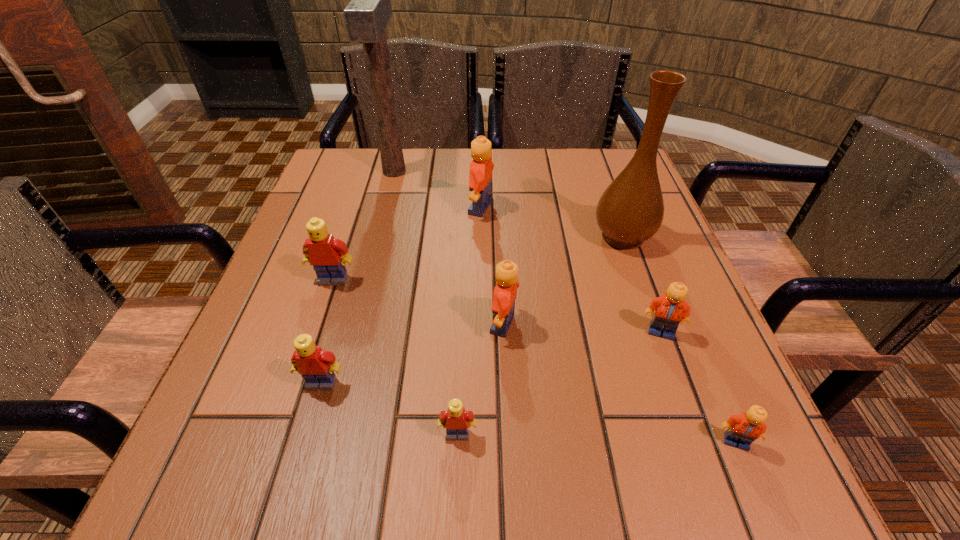
I want to click on free spot between the nearest yellow Lego and the fifth farthest Lego, so click(390, 409).

Image resolution: width=960 pixels, height=540 pixels. Identify the location of vacant space in between the third smallest orange Lego and the brown vase. (564, 280).

Image resolution: width=960 pixels, height=540 pixels. In order to click on free space between the vase and the second smallest orange Lego in this screenshot , I will do `click(641, 284)`.

Identify the location of free spot between the second smallest orange Lego and the nearest yellow Lego. (559, 383).

Identify the location of free spot between the brown vase and the farthest orange Lego. (552, 222).

I want to click on vacant space that's between the third nearest object and the smallest yellow Lego, so click(x=390, y=409).

The image size is (960, 540). What are the coordinates of `free point between the third smallest orange Lego and the biggest yellow Lego` in the screenshot? It's located at (419, 302).

This screenshot has height=540, width=960. What are the coordinates of `free point between the vase and the second smallest orange Lego` in the screenshot? It's located at (641, 284).

You are a GUI agent. You are given a task and a screenshot of the screen. Output one action in this format:
    pyautogui.click(x=<x>, y=<y>)
    Task: Click on the unoccupied position between the second biggest orange Lego and the smallest orange Lego
    This screenshot has height=540, width=960.
    Given the screenshot: What is the action you would take?
    pyautogui.click(x=619, y=383)

Image resolution: width=960 pixels, height=540 pixels. Identify the location of the fifth closest object to the second nearest yellow Lego. (670, 309).